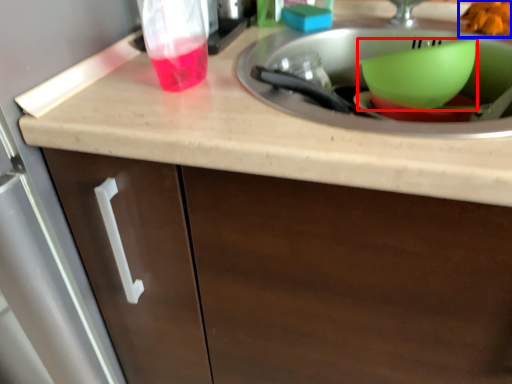
Question: Which object is further to the camera taking this photo, basin (highlighted by a red box) or food (highlighted by a blue box)?

Choices:
 (A) basin
 (B) food

Answer: (B)